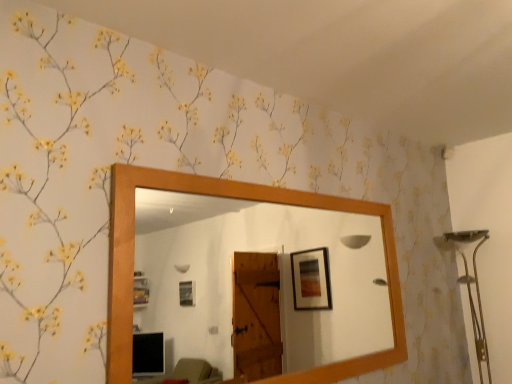
The width and height of the screenshot is (512, 384). In order to click on wooden mirror at center in this screenshot , I will do `click(280, 277)`.

The image size is (512, 384). Describe the element at coordinates (280, 277) in the screenshot. I see `wooden mirror at center` at that location.

This screenshot has height=384, width=512. What are the coordinates of `wooden mirror at center` in the screenshot? It's located at (280, 277).